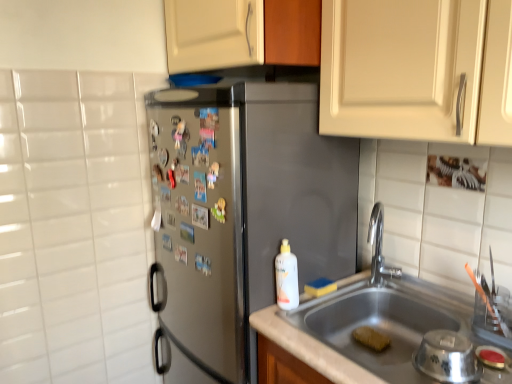
Question: From the image's perspective, is polished chrome faucet at sink right positioned above or below white matte bottle at sink?

Choices:
 (A) above
 (B) below

Answer: (A)

Question: Is polished chrome faucet at sink right spatially inside white matte bottle at sink, or outside of it?

Choices:
 (A) inside
 (B) outside

Answer: (B)

Question: Which object is the closest to the matte white cabinet at upper center?

Choices:
 (A) satin steel refrigerator at center
 (B) yellow sponge at sink bottom, which appears as the second food when viewed from the left
 (C) polished chrome faucet at sink right
 (D) white matte bottle at sink
 (E) yellow sponge at sink, the 2th food positioned from the bottom

Answer: (A)

Question: Which object is positioned farthest from the white matte bottle at sink?

Choices:
 (A) matte white cabinet at upper center
 (B) stainless steel bowl at sink
 (C) polished chrome faucet at sink right
 (D) stainless steel sink at lower right
 (E) yellow sponge at sink bottom, which is the 1th food from right to left

Answer: (A)